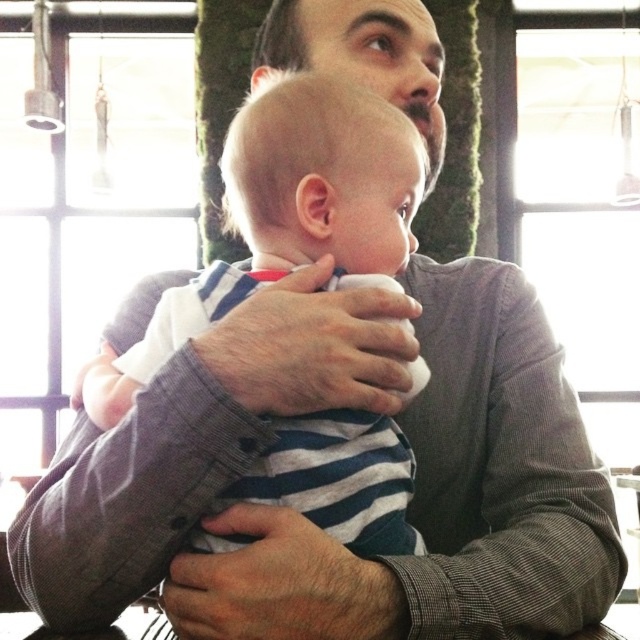
You are an AI analyzing the image. The gray checkered shirt at center is located at a specific coordinate. Can you determine if the shirt is positioned closer to the top or bottom of the image?

The gray checkered shirt at center is located at point 0.870 on the y axis, which is closer to the bottom of the image since lower y values are closer to the bottom.

What is the color of the shirt that the adult is wearing at the point marked by coordinates (x=432, y=556)?

The gray checkered shirt at center is the color of the shirt the adult is wearing at the point marked by coordinates (x=432, y=556).

You are a photographer setting up for a family portrait. You notice the gray checkered shirt at center and the white striped shirt at center in the scene. Which shirt should you adjust to ensure the other is fully visible?

The gray checkered shirt at center is positioned under the white striped shirt at center, so you should adjust the white striped shirt at center to move it out of the way so the gray checkered shirt at center can be fully visible.